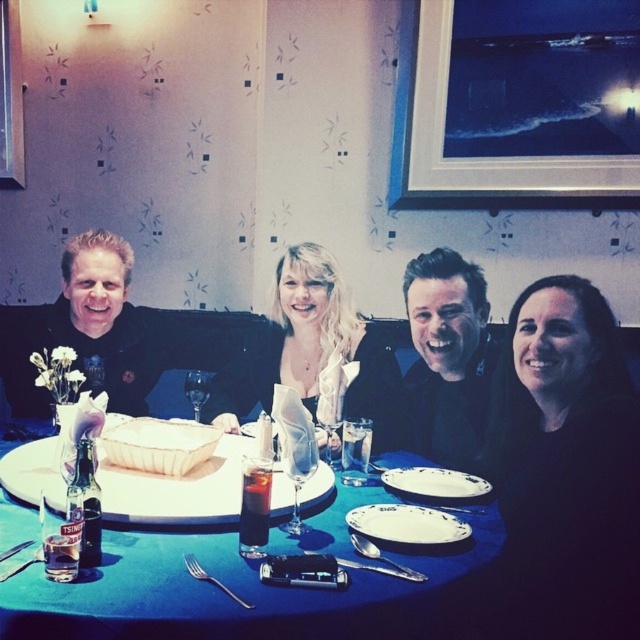
Question: Considering the relative positions of black matte shirt at lower right and matte white platter at center in the image provided, where is black matte shirt at lower right located with respect to matte white platter at center?

Choices:
 (A) right
 (B) left

Answer: (A)

Question: Can you confirm if black matte shirt at lower right is wider than black matte shirt at center?

Choices:
 (A) no
 (B) yes

Answer: (B)

Question: Does matte white platter at center have a lesser width compared to white ceramic plate at lower center?

Choices:
 (A) no
 (B) yes

Answer: (A)

Question: Which object appears closest to the camera in this image?

Choices:
 (A) black glossy picture frame at upper right
 (B) white ceramic plate at lower center

Answer: (B)

Question: Which point is farther to the camera?

Choices:
 (A) (413, 310)
 (B) (522, 620)

Answer: (A)

Question: Based on their relative distances, which object is nearer to the matte black shirt at left?

Choices:
 (A) matte white platter at center
 (B) black matte shirt at lower right

Answer: (A)